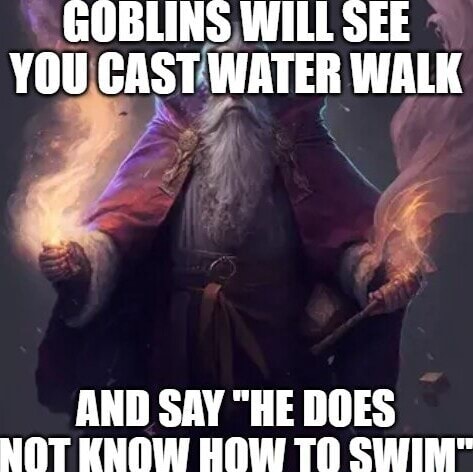
This screenshot has width=473, height=472. In order to click on robe in this screenshot , I will do `click(332, 245)`.